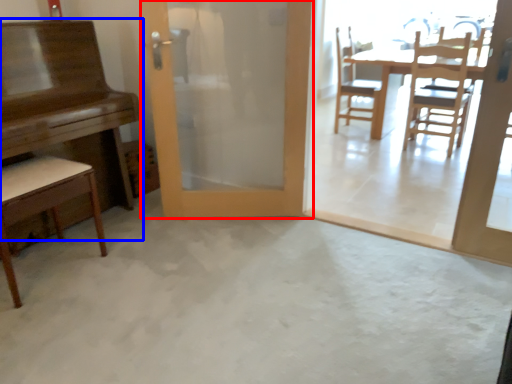
Question: Among these objects, which one is nearest to the camera, door (highlighted by a red box) or table (highlighted by a blue box)?

Choices:
 (A) door
 (B) table

Answer: (B)